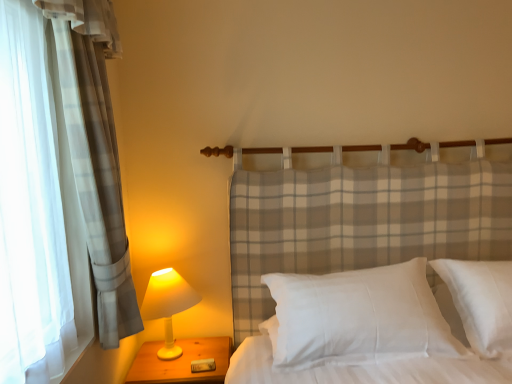
In order to click on vacant space behind white matte lamp at left in this screenshot , I will do coord(180,337).